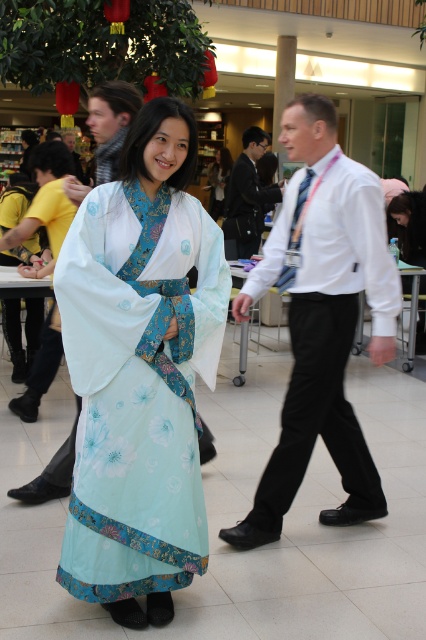
You are an observer looking at the scene and notice the matte black scarf at upper left and the light blue floral kimono at center. Which object is located to the left of the other?

The matte black scarf at upper left is positioned on the left side of light blue floral kimono at center.

You are standing in the shopping mall scene described. You need to locate the matte black scarf at upper left. According to the coordinates provided, where exactly is it positioned?

The matte black scarf at upper left is positioned at coordinates point (111, 124).

You are a photographer trying to capture both the white shirt at center and the matte black shirt at center in a single frame. Which shirt will appear bigger in your photo?

The white shirt at center will appear bigger in the photo because it is larger in size than the matte black shirt at center.